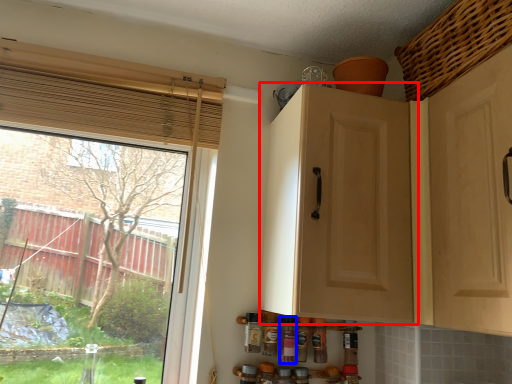
Question: Which object is closer to the camera taking this photo, cabinetry (highlighted by a red box) or bottle (highlighted by a blue box)?

Choices:
 (A) cabinetry
 (B) bottle

Answer: (A)